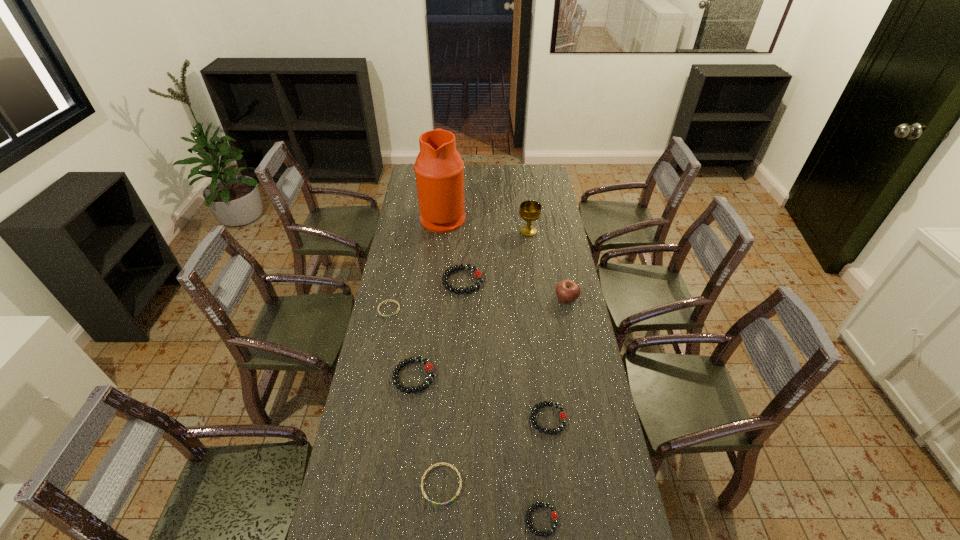
Where is `the sixth tallest object`? the sixth tallest object is located at coordinates (563, 416).

What are the coordinates of `the bigger blue bracelet` in the screenshot? It's located at point(445,464).

Identify the location of the nearer blue bracelet. This screenshot has height=540, width=960. (445, 464).

Identify the location of the nearest black bracelet. This screenshot has height=540, width=960. (554, 515).

I want to click on the farther blue bracelet, so click(x=390, y=299).

The height and width of the screenshot is (540, 960). I want to click on the fifth nearest bracelet, so click(x=390, y=299).

Identify the location of free region located 0.290m from the spout of the water jug. (522, 217).

Identify the location of free space located on the left of the chalice. This screenshot has width=960, height=540. (449, 232).

Image resolution: width=960 pixels, height=540 pixels. What are the coordinates of `free region located on the side of the rightmost object with the unique marking` in the screenshot? It's located at (572, 329).

The image size is (960, 540). Find the location of `vacant space positioned 0.090m on the back of the farthest bracelet`. vacant space positioned 0.090m on the back of the farthest bracelet is located at coordinates (464, 254).